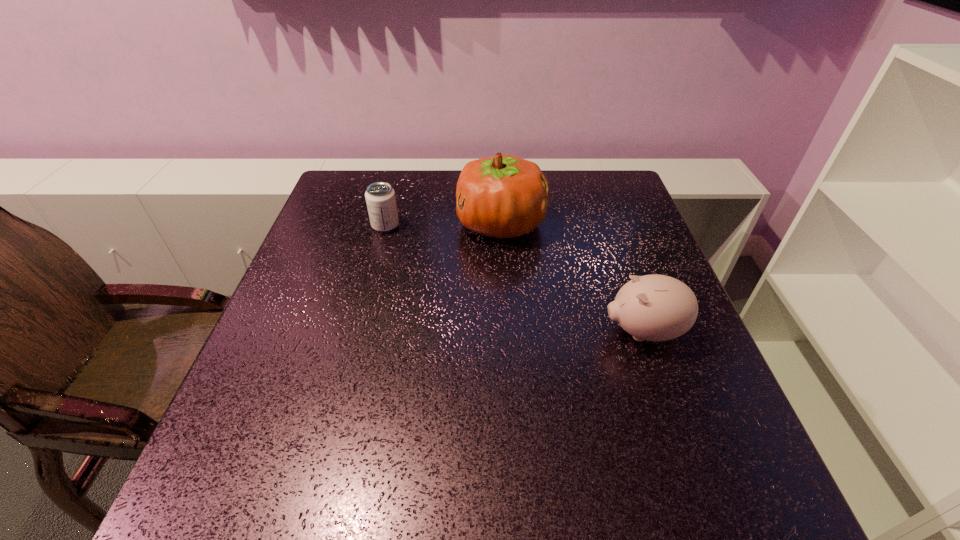
The width and height of the screenshot is (960, 540). I want to click on vacant space at the far left corner of the desktop, so click(370, 176).

Locate an element on the screen. The height and width of the screenshot is (540, 960). empty space between the tallest object and the nearest object is located at coordinates (572, 278).

I want to click on free area in between the piggy bank and the second object from left to right, so click(x=572, y=278).

At what (x,y) coordinates should I click in order to perform the action: click on vacant space that is in between the nearest object and the leftmost object. Please return your answer as a coordinate pair (x, y). The height and width of the screenshot is (540, 960). Looking at the image, I should click on (515, 279).

The image size is (960, 540). Find the location of `vacant point located between the nearest object and the shortest object`. vacant point located between the nearest object and the shortest object is located at coordinates (515, 279).

This screenshot has height=540, width=960. I want to click on empty location between the shortest object and the pumpkin, so click(x=444, y=225).

Identify the location of vacant area that lies between the shortest object and the second object from right to left. (444, 225).

The width and height of the screenshot is (960, 540). What are the coordinates of `blank region between the pumpkin and the nearest object` in the screenshot? It's located at (572, 278).

Identify the location of free space between the second shortest object and the second object from left to right. coord(572,278).

Identify the location of empty space between the soda can and the rightmost object. This screenshot has width=960, height=540. (515, 279).